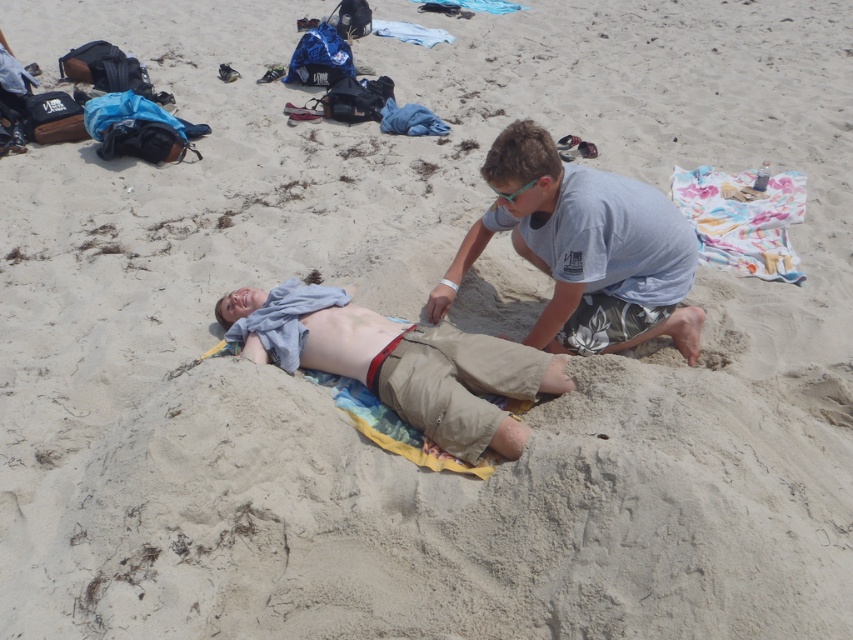
Question: Does gray cotton shirt at center appear on the left side of multicolored fabric towel at upper center?

Choices:
 (A) yes
 (B) no

Answer: (A)

Question: Considering the real-world distances, which object is closest to the green plastic goggles at upper center?

Choices:
 (A) beige cotton shorts at center
 (B) multicolored fabric towel at upper center

Answer: (A)

Question: Considering the real-world distances, which object is closest to the green plastic goggles at upper center?

Choices:
 (A) multicolored fabric towel at upper center
 (B) gray cotton shirt at center
 (C) beige cotton shorts at center

Answer: (B)

Question: Where is beige cotton shorts at center located in relation to multicolored fabric towel at upper center in the image?

Choices:
 (A) right
 (B) left

Answer: (B)

Question: Which object is farther from the camera taking this photo?

Choices:
 (A) green plastic goggles at upper center
 (B) multicolored fabric towel at upper center
 (C) gray cotton shirt at center

Answer: (B)

Question: Does beige cotton shorts at center appear on the right side of green plastic goggles at upper center?

Choices:
 (A) no
 (B) yes

Answer: (A)